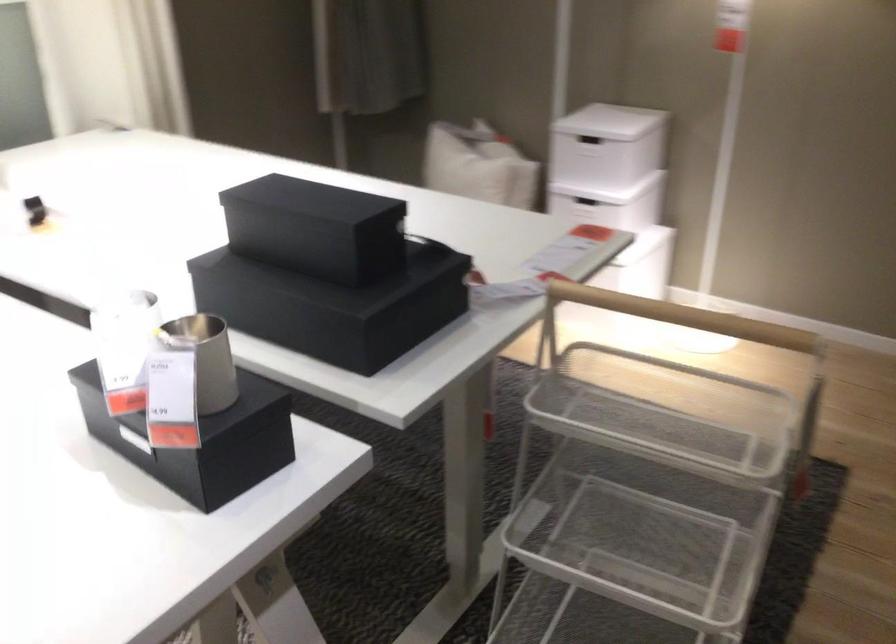
The image size is (896, 644). Describe the element at coordinates (712, 313) in the screenshot. I see `the wooden cart handle` at that location.